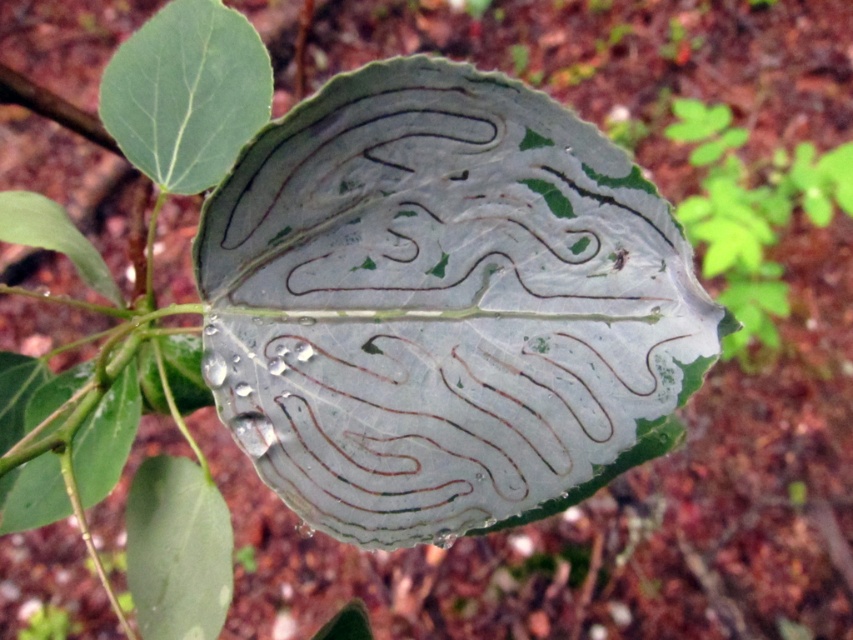
You are an entomologist examining a leaf under a microscope. The leaf has intricate patterns caused by insect activity. You need to locate the green matte leaf at upper left. Where exactly is it positioned on the coordinate system?

The green matte leaf at upper left is positioned at point (186, 93) on the coordinate system.

From the picture: You are an entomologist examining two green matte leaves in an image. The leaves are labeled as the green matte leaf at upper left and the green matte leaf at lower left. Based on their positions, which leaf would you observe first if you start looking from the top of the image and move downward?

The green matte leaf at upper left would be observed first as it is positioned above the green matte leaf at lower left when moving downward from the top of the image.

You are an entomologist examining two leaves in the image. You notice that the green matte leaf at lower left and the green translucent leaf at lower left are positioned in a way that one is blocking the other. Which leaf is closer to you?

The green matte leaf at lower left is closer to you because it is in front of the green translucent leaf at lower left.